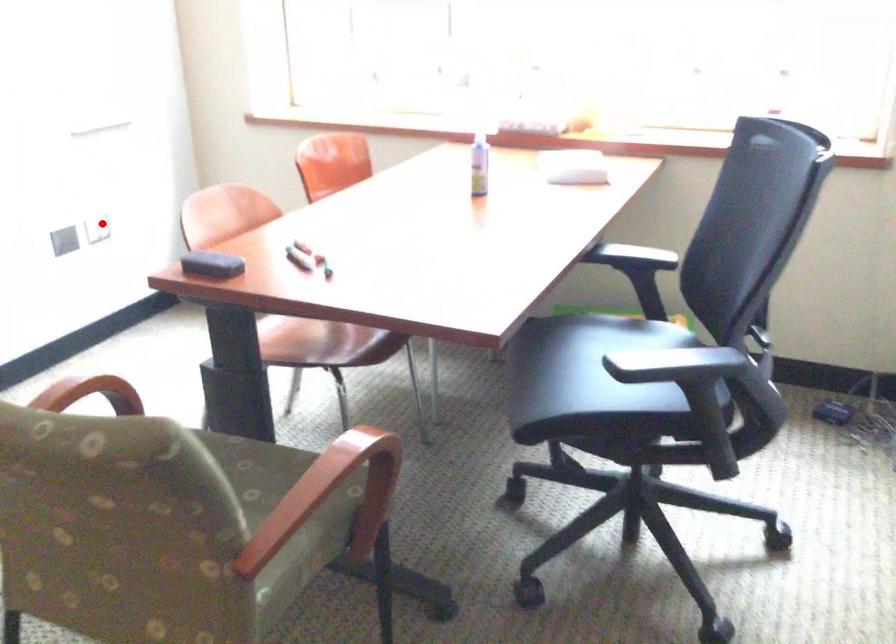
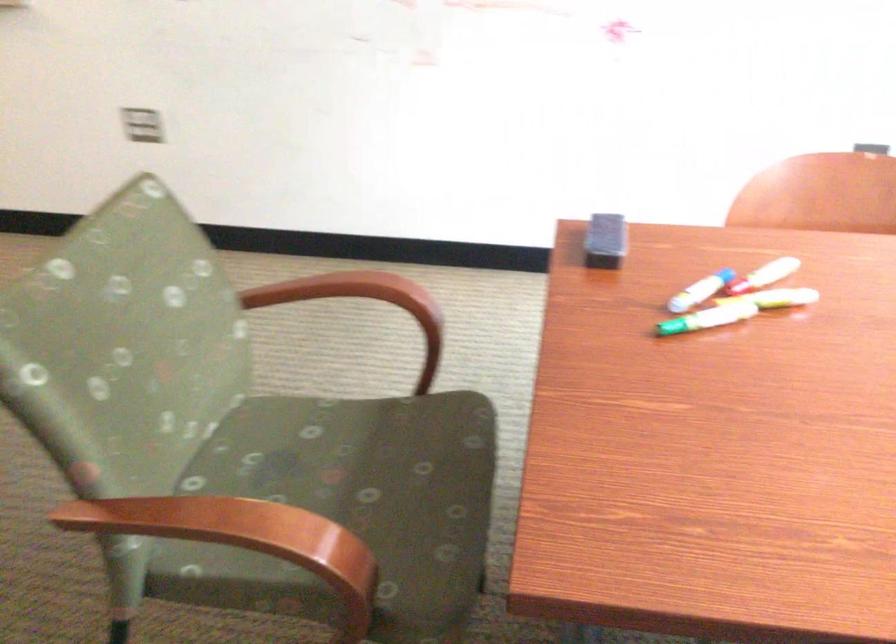
Question: I am providing you with two images of the same scene from different viewpoints. Given a red point in image1, look at the same physical point in image2. Is it:

Choices:
 (A) Closer to the viewpoint
 (B) Farther from the viewpoint

Answer: (A)